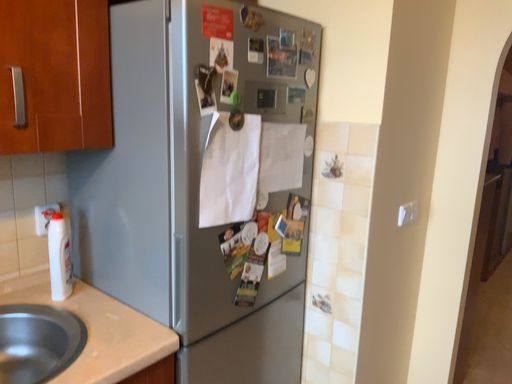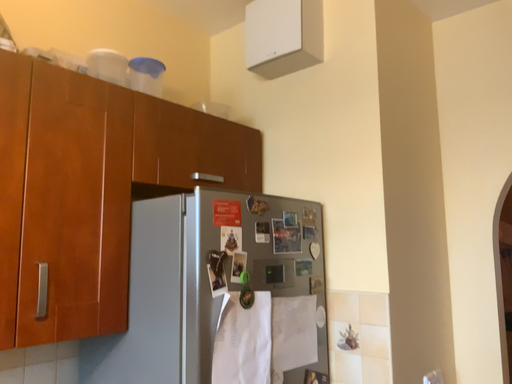
Question: How did the camera likely rotate when shooting the video?

Choices:
 (A) rotated upward
 (B) rotated downward

Answer: (A)